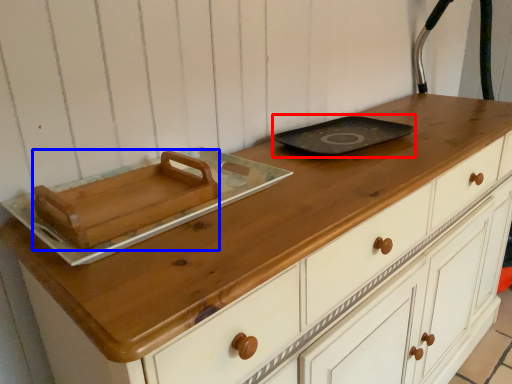
Question: Among these objects, which one is nearest to the camera, frying pan (highlighted by a red box) or food (highlighted by a blue box)?

Choices:
 (A) frying pan
 (B) food

Answer: (B)